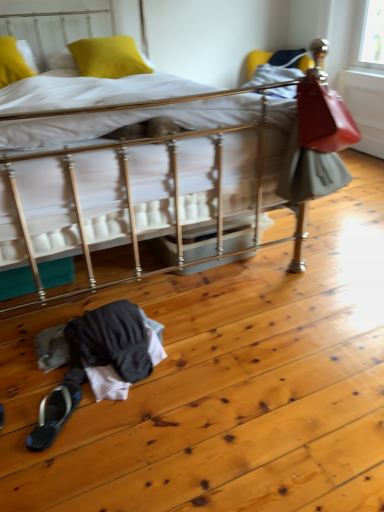
Question: From the image's perspective, is black fabric slipper at lower left located beneath yellow matte pillow at upper left, the second pillow positioned from the left?

Choices:
 (A) yes
 (B) no

Answer: (A)

Question: From the image's perspective, is black fabric slipper at lower left above yellow matte pillow at upper left, which is the 1th pillow from right to left?

Choices:
 (A) yes
 (B) no

Answer: (B)

Question: Is black fabric slipper at lower left oriented away from yellow matte pillow at upper left, the second pillow positioned from the left?

Choices:
 (A) no
 (B) yes

Answer: (A)

Question: Are black fabric slipper at lower left and yellow matte pillow at upper left, which is the 1th pillow from right to left, making contact?

Choices:
 (A) yes
 (B) no

Answer: (B)

Question: Is black fabric slipper at lower left shorter than yellow matte pillow at upper left, which is the 1th pillow from right to left?

Choices:
 (A) yes
 (B) no

Answer: (A)

Question: Is black fabric slipper at lower left wider or thinner than yellow fabric pillow at upper left, which ranks as the second pillow in right-to-left order?

Choices:
 (A) thin
 (B) wide

Answer: (A)

Question: Is black fabric slipper at lower left to the left or to the right of yellow fabric pillow at upper left, which ranks as the second pillow in right-to-left order, in the image?

Choices:
 (A) right
 (B) left

Answer: (A)

Question: Considering the positions of point (67, 415) and point (1, 62), is point (67, 415) closer or farther from the camera than point (1, 62)?

Choices:
 (A) closer
 (B) farther

Answer: (A)

Question: Is black fabric slipper at lower left bigger or smaller than yellow fabric pillow at upper left, the first pillow when ordered from left to right?

Choices:
 (A) big
 (B) small

Answer: (B)

Question: In the image, is black fabric slipper at lower left on the left side or the right side of yellow matte pillow at upper left, which is the 1th pillow from right to left?

Choices:
 (A) right
 (B) left

Answer: (A)

Question: Based on their sizes in the image, would you say black fabric slipper at lower left is bigger or smaller than yellow matte pillow at upper left, which is the 1th pillow from right to left?

Choices:
 (A) big
 (B) small

Answer: (B)

Question: From the image's perspective, is black fabric slipper at lower left positioned above or below yellow matte pillow at upper left, the second pillow positioned from the left?

Choices:
 (A) above
 (B) below

Answer: (B)

Question: Is point (61, 381) closer or farther from the camera than point (99, 56)?

Choices:
 (A) closer
 (B) farther

Answer: (A)

Question: Considering the positions of yellow fabric pillow at upper left, which ranks as the second pillow in right-to-left order, and yellow matte pillow at upper left, the second pillow positioned from the left, in the image, is yellow fabric pillow at upper left, which ranks as the second pillow in right-to-left order, wider or thinner than yellow matte pillow at upper left, the second pillow positioned from the left,?

Choices:
 (A) wide
 (B) thin

Answer: (B)

Question: Do you think yellow fabric pillow at upper left, which ranks as the second pillow in right-to-left order, is within yellow matte pillow at upper left, which is the 1th pillow from right to left, or outside of it?

Choices:
 (A) inside
 (B) outside

Answer: (B)